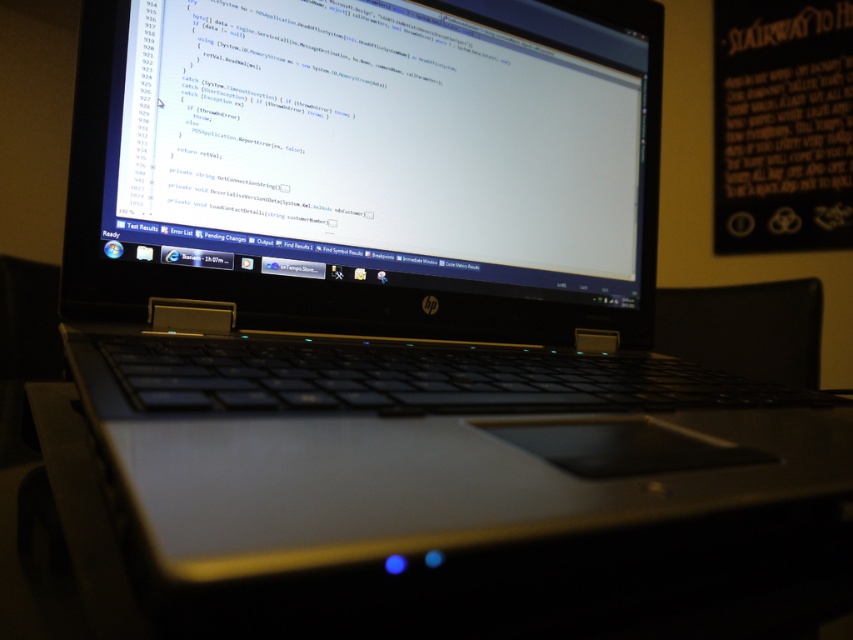
How far apart are white glossy screen at center and black matte bulletin board at upper right?

They are 5.82 feet apart.

Does white glossy screen at center appear on the left side of black matte bulletin board at upper right?

Yes, white glossy screen at center is to the left of black matte bulletin board at upper right.

This screenshot has height=640, width=853. Describe the element at coordinates (379, 141) in the screenshot. I see `white glossy screen at center` at that location.

I want to click on white glossy screen at center, so click(379, 141).